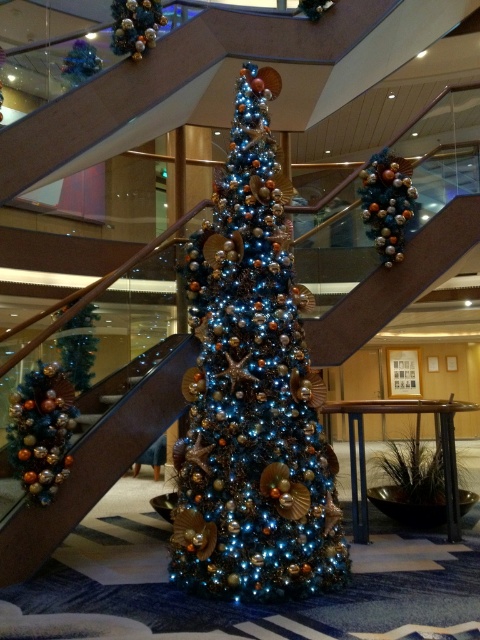
Question: Which point is farther to the camera?

Choices:
 (A) (289, 552)
 (B) (69, 352)
 (C) (68, 54)

Answer: (C)

Question: Is shiny metallic ornaments at upper center thinner than metallic blue ornament at upper left?

Choices:
 (A) yes
 (B) no

Answer: (B)

Question: From the image, what is the correct spatial relationship of shiny metallic garland at left in relation to metallic blue ornament at upper left?

Choices:
 (A) right
 (B) left

Answer: (A)

Question: Is iridescent metallic christmas tree at center wider than green matte christmas tree at left?

Choices:
 (A) no
 (B) yes

Answer: (B)

Question: Which point is closer to the camera?

Choices:
 (A) shiny metallic ornaments at upper center
 (B) metallic blue ornament at upper left

Answer: (A)

Question: Which point is closer to the camera taking this photo?

Choices:
 (A) (296, 323)
 (B) (21, 435)
 (C) (372, 216)
 (D) (93, 74)

Answer: (A)